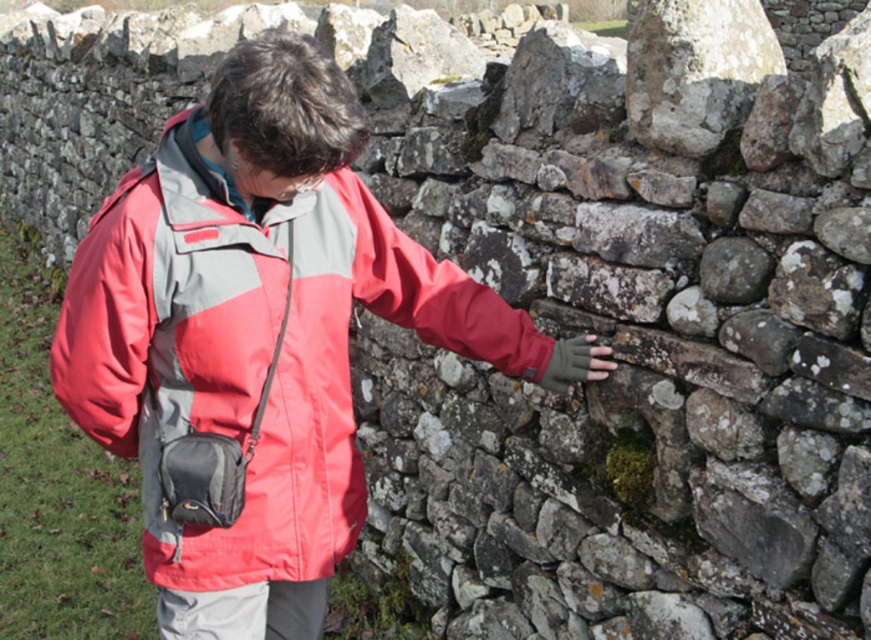
Is point (308, 289) positioned in front of point (760, 56)?

Yes, it is in front of point (760, 56).

Is the position of matte nylon jacket at center less distant than that of speckled stone at upper right?

Yes, matte nylon jacket at center is closer to the viewer.

Locate an element on the screen. The width and height of the screenshot is (871, 640). matte nylon jacket at center is located at coordinates (252, 349).